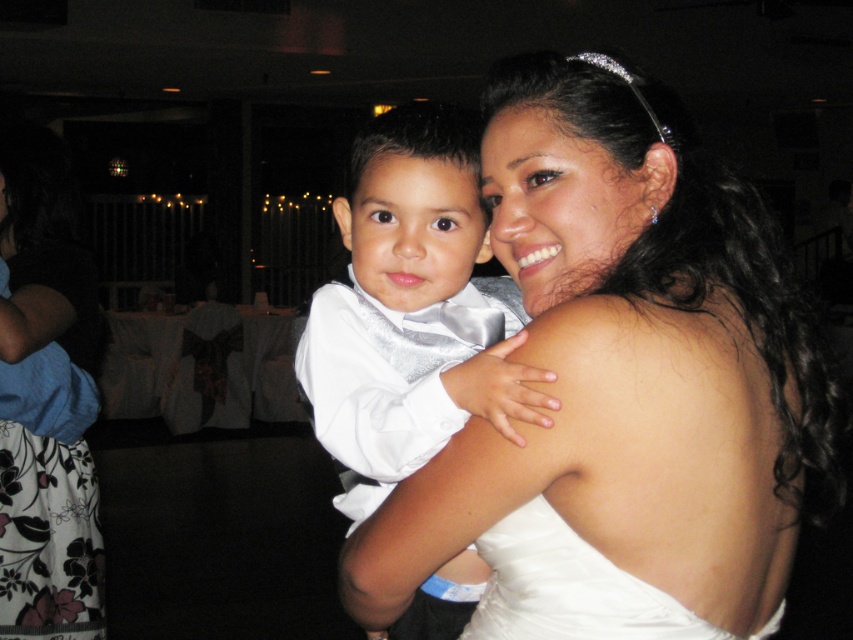
You are a photographer at a wedding reception and need to ensure that the white satin bow tie at center and the white satin dress at center are both visible in the frame. Given their sizes, which one might you need to adjust your focus on to ensure clarity?

The white satin bow tie at center is larger in size than the white satin dress at center, so you should focus on the white satin bow tie at center to ensure clarity since it occupies more space in the frame.

You are a photographer at a wedding reception and want to capture a closeup of the white satin dress at upper center. The camera you are using has a minimum focusing distance of 30 inches. Can you take the photo without moving the dress?

The white satin dress at upper center and viewer are 31.64 inches apart. Since the minimum focusing distance is 30 inches, the camera can focus on the white satin dress at upper center from this distance and take the photo without needing to move the dress.

Based on the scene description, which dress is positioned higher in the image, the white satin dress at upper center or the floral print dress at lower left?

The white satin dress at upper center is positioned higher in the image than the floral print dress at lower left.